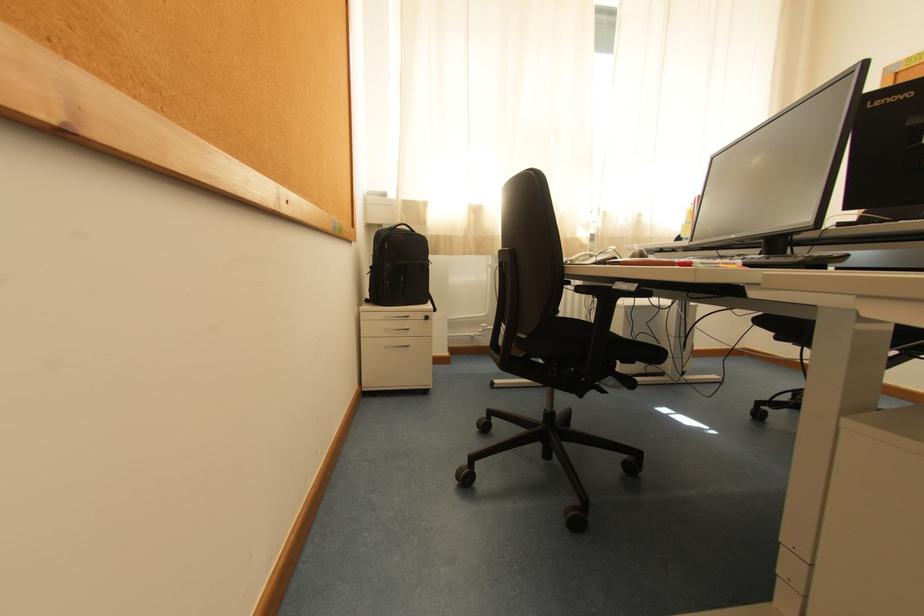
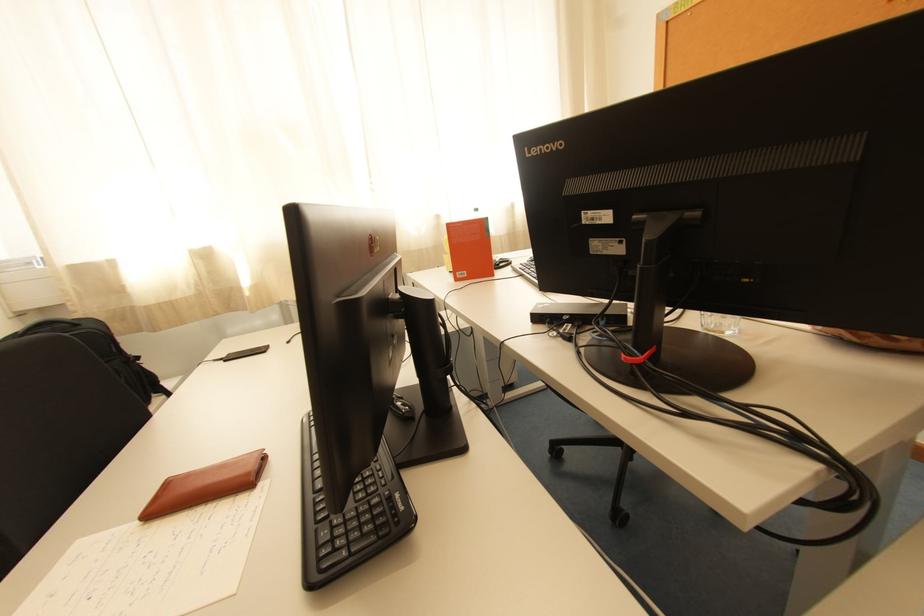
In a continuous first-person perspective shot, in which direction is the camera moving?

The movement direction of the cameraman is right, forward.